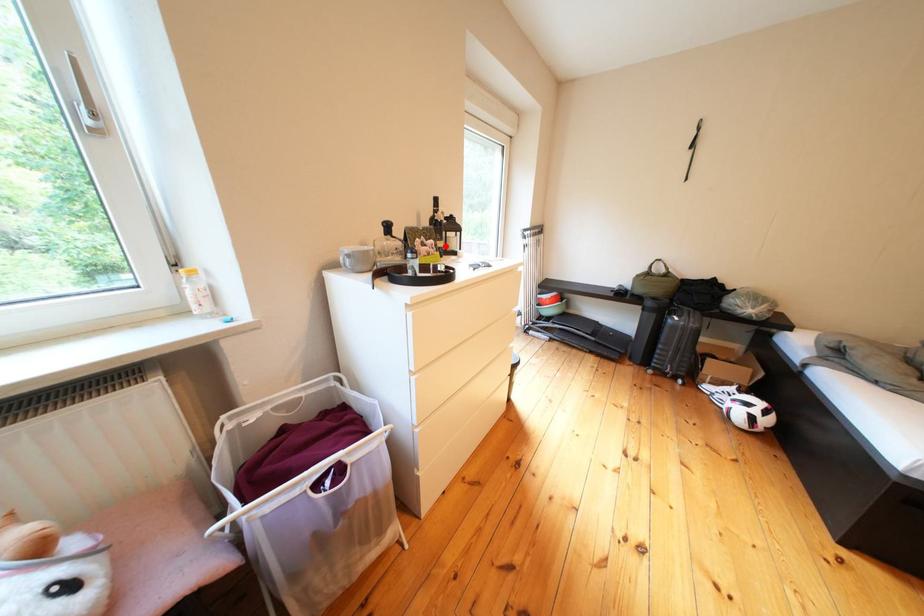
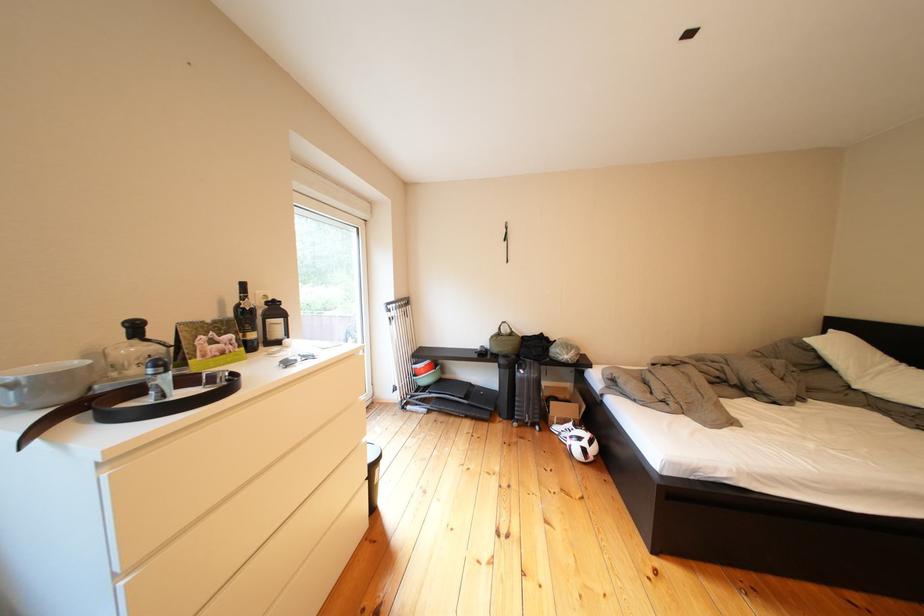
In the second image, find the point that corresponds to the highlighted location in the first image.

(245, 341)